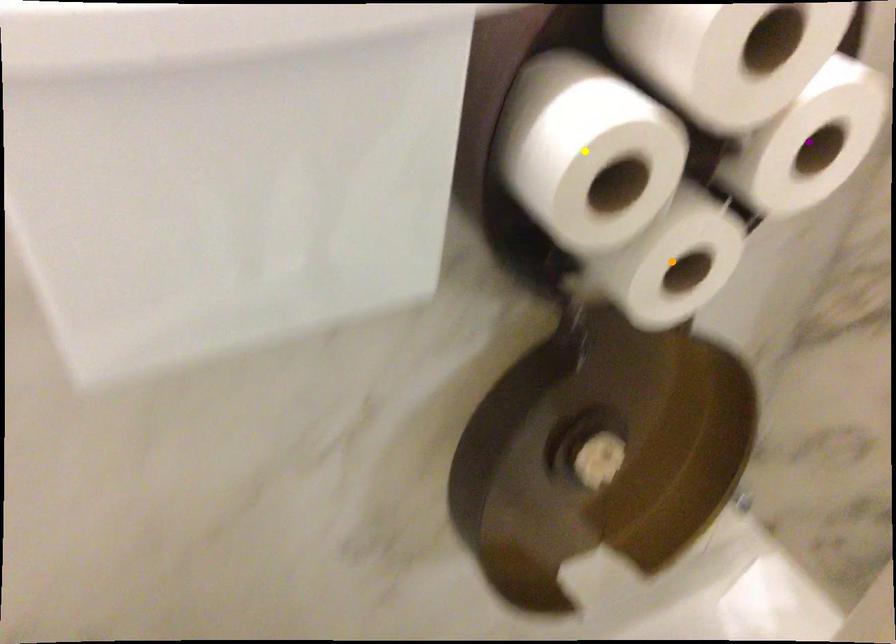
Order these from nearest to farthest:
purple point, yellow point, orange point

orange point
purple point
yellow point